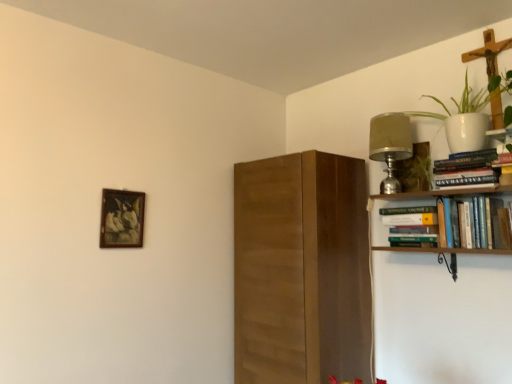
Question: Is hardcover book at upper right, which is counted as the second book, starting from the top, located outside hardcover books at upper right, marked as the first book in a bottom-to-top arrangement?

Choices:
 (A) yes
 (B) no

Answer: (B)

Question: Are hardcover book at upper right, which is counted as the second book, starting from the top, and hardcover books at upper right, marked as the first book in a bottom-to-top arrangement, far apart?

Choices:
 (A) yes
 (B) no

Answer: (B)

Question: Is the depth of hardcover book at upper right, which is counted as the second book, starting from the top, greater than that of hardcover books at upper right, which is the 3th book from top to bottom?

Choices:
 (A) yes
 (B) no

Answer: (A)

Question: Can hardcover books at upper right, marked as the first book in a bottom-to-top arrangement, be found inside hardcover book at upper right, the second book positioned from the bottom?

Choices:
 (A) no
 (B) yes

Answer: (A)

Question: Is hardcover book at upper right, which is counted as the second book, starting from the top, aimed at hardcover books at upper right, marked as the first book in a bottom-to-top arrangement?

Choices:
 (A) no
 (B) yes

Answer: (B)

Question: Visually, is matte silver lamp at upper right positioned to the left or to the right of hardcover books at upper right, which is the 3th book from top to bottom?

Choices:
 (A) right
 (B) left

Answer: (B)

Question: Is point (389, 190) closer or farther from the camera than point (425, 195)?

Choices:
 (A) farther
 (B) closer

Answer: (A)

Question: From a real-world perspective, is matte silver lamp at upper right positioned above or below hardcover books at upper right, marked as the first book in a bottom-to-top arrangement?

Choices:
 (A) below
 (B) above

Answer: (B)

Question: In terms of height, does matte silver lamp at upper right look taller or shorter compared to hardcover books at upper right, marked as the first book in a bottom-to-top arrangement?

Choices:
 (A) short
 (B) tall

Answer: (A)

Question: Based on their sizes in the image, would you say matte silver lamp at upper right is bigger or smaller than white ceramic pot at upper right?

Choices:
 (A) small
 (B) big

Answer: (A)

Question: Does point (390, 137) appear closer or farther from the camera than point (482, 120)?

Choices:
 (A) closer
 (B) farther

Answer: (B)

Question: From their relative heights in the image, would you say matte silver lamp at upper right is taller or shorter than white ceramic pot at upper right?

Choices:
 (A) tall
 (B) short

Answer: (A)

Question: From a real-world perspective, is matte silver lamp at upper right above or below white ceramic pot at upper right?

Choices:
 (A) below
 (B) above

Answer: (A)

Question: In terms of width, does hardcover book at upper right, which is counted as the second book, starting from the top, look wider or thinner when compared to hardcover books at upper right, arranged as the 1th book when viewed from the top?

Choices:
 (A) thin
 (B) wide

Answer: (B)

Question: Considering the positions of point (428, 221) and point (442, 168), is point (428, 221) closer or farther from the camera than point (442, 168)?

Choices:
 (A) closer
 (B) farther

Answer: (B)